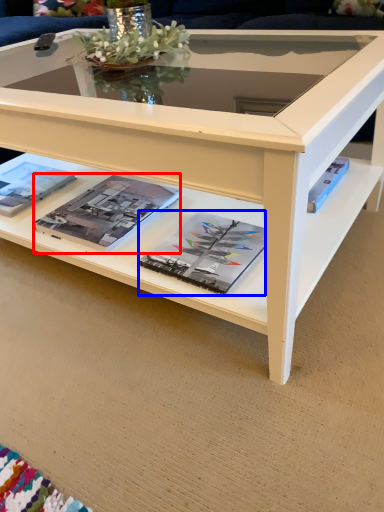
Question: Which object appears farthest to the camera in this image, magazine (highlighted by a red box) or magazine (highlighted by a blue box)?

Choices:
 (A) magazine
 (B) magazine

Answer: (A)